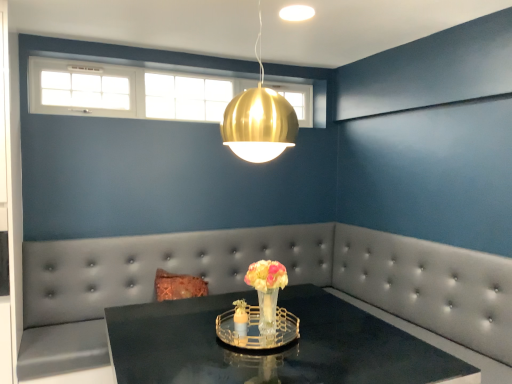
Question: Based on their sizes in the image, would you say gold metallic sphere at upper center is bigger or smaller than translucent glass vase at center?

Choices:
 (A) small
 (B) big

Answer: (B)

Question: From the image's perspective, is gold metallic sphere at upper center above or below translucent glass vase at center?

Choices:
 (A) below
 (B) above

Answer: (B)

Question: Based on their relative distances, which object is nearer to the translucent glass vase at center?

Choices:
 (A) gold metallic sphere at upper center
 (B) tufted leather couch at center
 (C) white glass window at upper center
 (D) shiny black table at center

Answer: (D)

Question: Which of these objects is positioned closest to the tufted leather couch at center?

Choices:
 (A) shiny black table at center
 (B) translucent glass vase at center
 (C) gold metallic sphere at upper center
 (D) white glass window at upper center

Answer: (A)